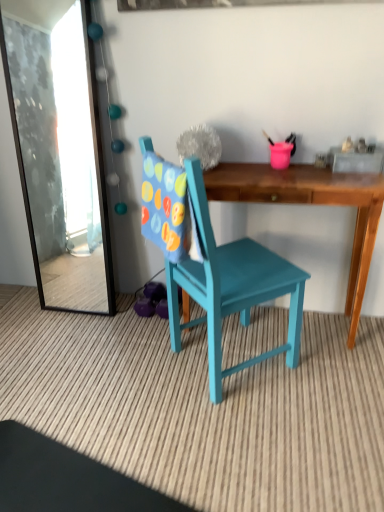
Question: From a real-world perspective, is wooden desk at center physically located above or below teal painted wood chair at center?

Choices:
 (A) below
 (B) above

Answer: (A)

Question: Based on their sizes in the image, would you say wooden desk at center is bigger or smaller than teal painted wood chair at center?

Choices:
 (A) small
 (B) big

Answer: (A)

Question: Estimate the real-world distances between objects in this image. Which object is closer to the wooden desk at center?

Choices:
 (A) transparent glass mirror at upper left
 (B) teal painted wood chair at center

Answer: (B)

Question: Which of these objects is positioned farthest from the teal painted wood chair at center?

Choices:
 (A) transparent glass mirror at upper left
 (B) wooden desk at center

Answer: (A)